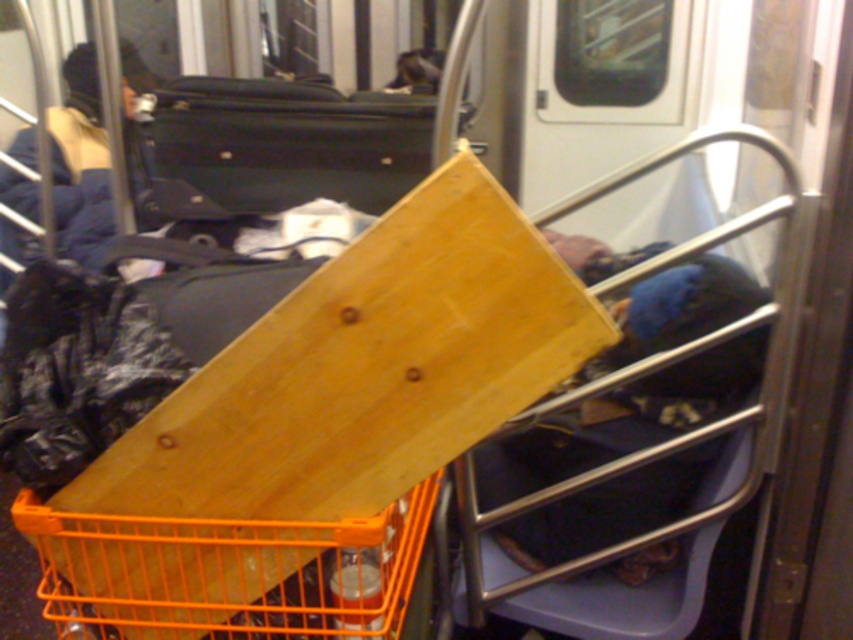
You are a passenger on the train and want to know if you can reach the point closer to you without moving from your seat. Which of the two points, point [119,602] or point [347,177], is closer to you?

Point [119,602] is closer to the camera than point [347,177], so the closer point to you is point [119,602].

You are standing in a subway car and need to reach a point marked at coordinates (x=343, y=586). If your arm can extend 1 meter, can you reach that point without moving your feet?

The point at (x=343, y=586) is 1.13 meters away from you, which is beyond your arm reach of 1 meter. You cannot reach it without moving your feet.

You are a passenger on a train and need to place your orange plastic basket at center and black hard suitcase at upper center in a storage compartment. The compartment has a width of 1 meter. Can both items fit side by side horizontally?

The orange plastic basket at center is to the right of black hard suitcase at upper center, but their individual widths are not provided. Therefore, it is impossible to determine if they can fit side by side in the 1 meter wide storage compartment without knowing their specific dimensions.